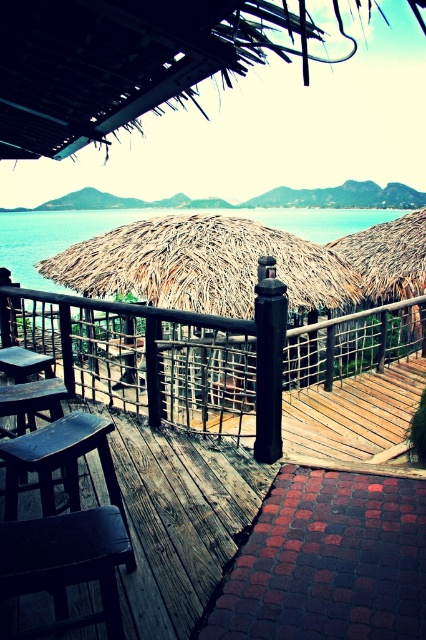
Question: Can you confirm if wooden deck at center is positioned to the left of dark wood stool at lower left?

Choices:
 (A) yes
 (B) no

Answer: (B)

Question: Can you confirm if wooden deck at center is wider than dark wood stool at lower left?

Choices:
 (A) yes
 (B) no

Answer: (A)

Question: Is wooden deck at center thinner than dark wood stool at lower left?

Choices:
 (A) yes
 (B) no

Answer: (B)

Question: Which object appears farthest from the camera in this image?

Choices:
 (A) dark wood stool at lower left
 (B) wooden deck at center

Answer: (B)